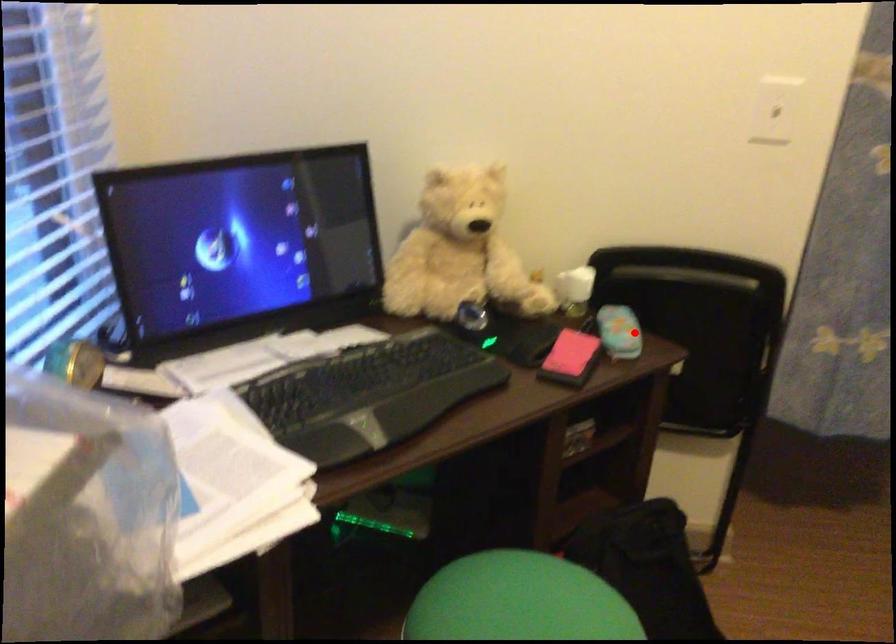
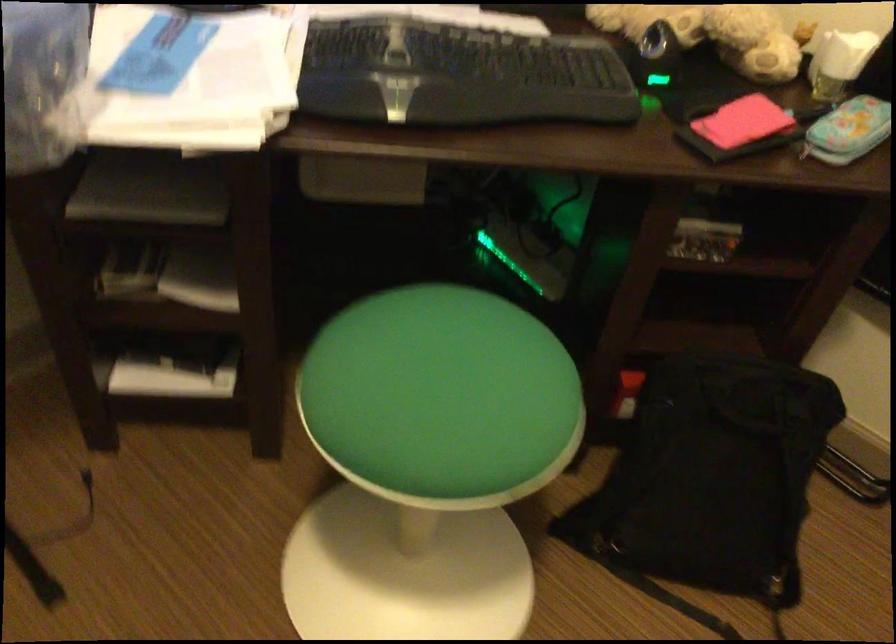
Where in the second image is the point corresponding to the highlighted location from the first image?

(848, 129)